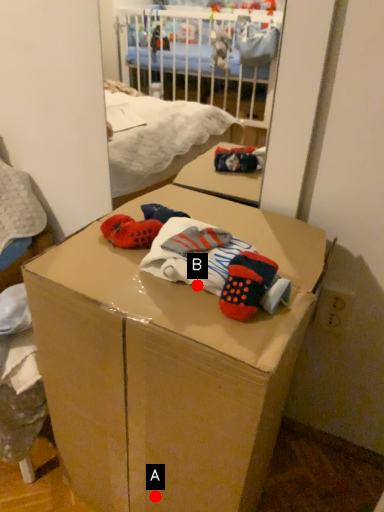
Question: Two points are circled on the image, labeled by A and B beside each circle. Which point is farther to the camera?

Choices:
 (A) A is further
 (B) B is further

Answer: (A)